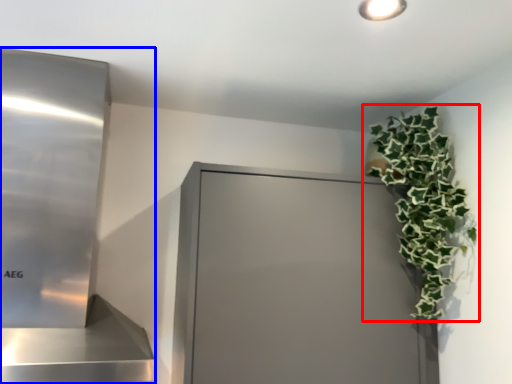
Question: Which object is further to the camera taking this photo, houseplant (highlighted by a red box) or appliance (highlighted by a blue box)?

Choices:
 (A) houseplant
 (B) appliance

Answer: (A)